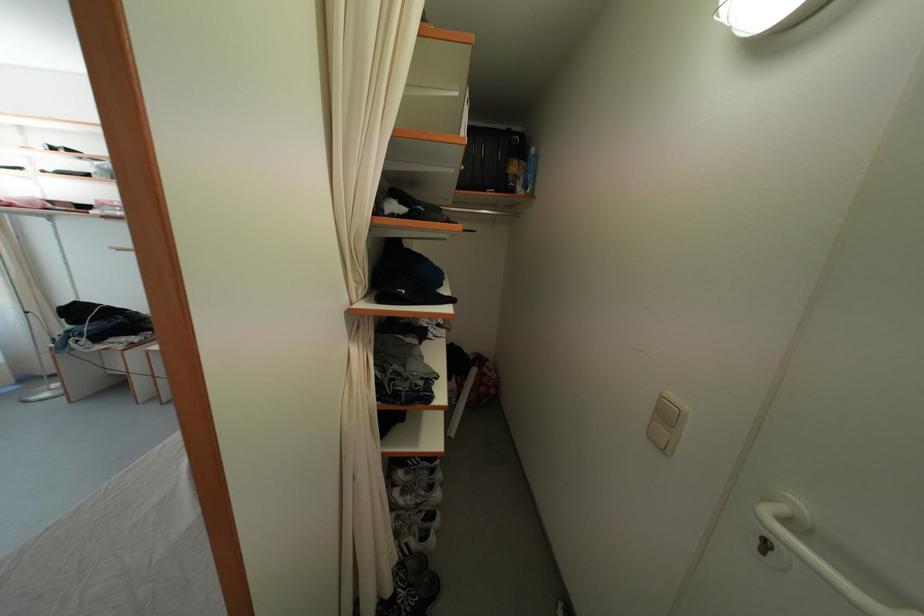
Where would you pull the white door handle? Please return your answer as a coordinate pair (x, y).

(816, 552)